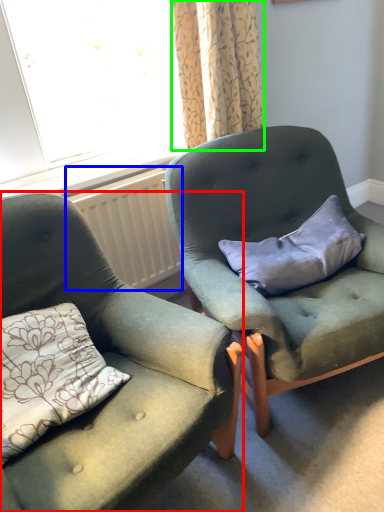
Question: Considering the real-world distances, which object is farthest from chair (highlighted by a red box)? radiator (highlighted by a blue box) or curtain (highlighted by a green box)?

Choices:
 (A) radiator
 (B) curtain

Answer: (B)